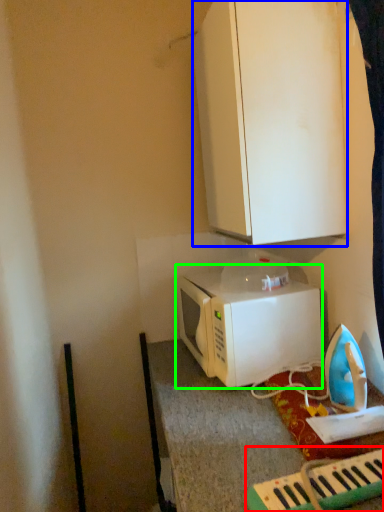
Question: Which is farther away from musical keyboard (highlighted by a red box)? cabinetry (highlighted by a blue box) or microwave oven (highlighted by a green box)?

Choices:
 (A) cabinetry
 (B) microwave oven

Answer: (A)